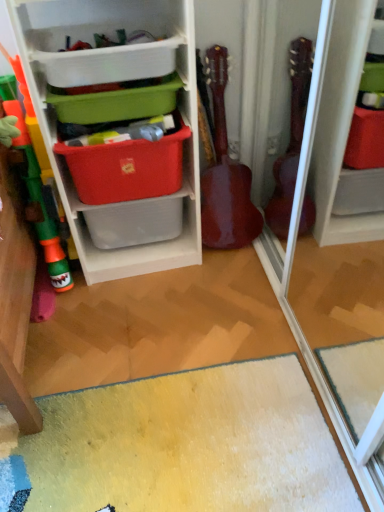
Where is `free space above red fabric storage box at center, the first storage box from the bottom (from a real-world perspective)`? The height and width of the screenshot is (512, 384). free space above red fabric storage box at center, the first storage box from the bottom (from a real-world perspective) is located at coordinates (126, 129).